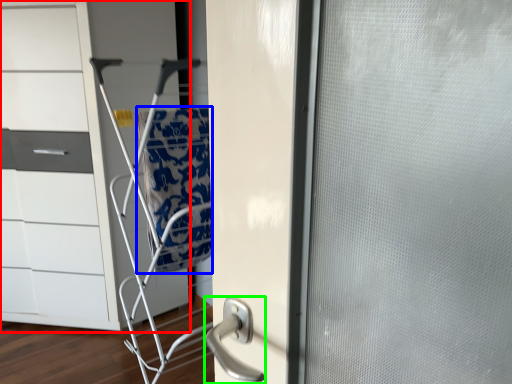
Question: Considering the real-world distances, which object is farthest from chest of drawers (highlighted by a red box)? blanket (highlighted by a blue box) or door handle (highlighted by a green box)?

Choices:
 (A) blanket
 (B) door handle

Answer: (B)